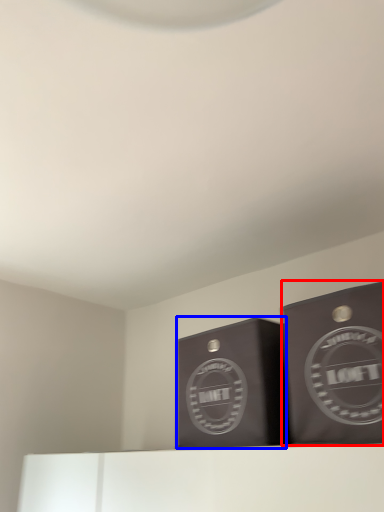
Question: Which object appears closest to the camera in this image, cardboard box (highlighted by a red box) or cardboard box (highlighted by a blue box)?

Choices:
 (A) cardboard box
 (B) cardboard box

Answer: (A)